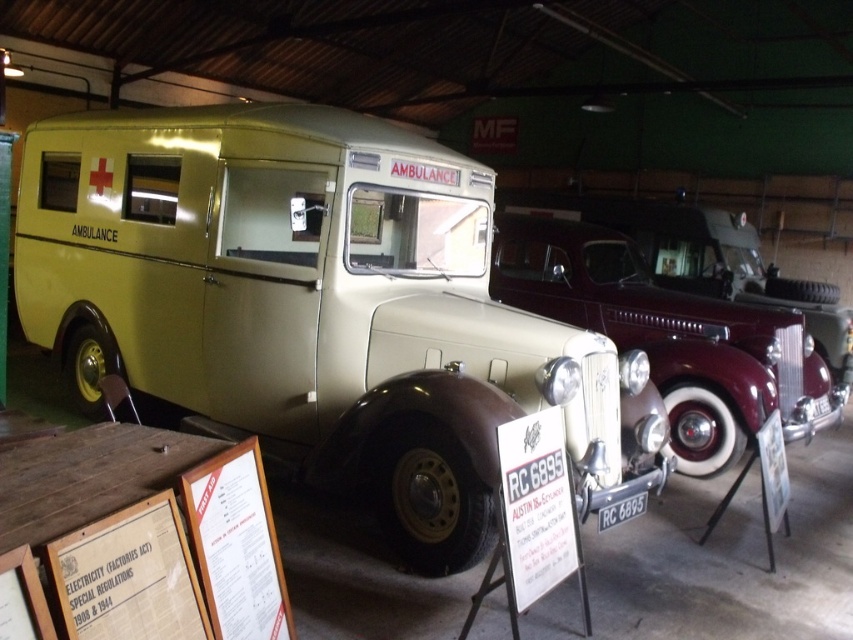
You are a museum guide explaining the vehicles to visitors. You need to mention both the matte beige ambulance at center and the maroon glossy car at center. Which vehicle is bigger?

The matte beige ambulance at center is larger in size compared to the maroon glossy car at center.

You are a tour guide leading a group through the museum. You want to ensure visitors can walk between the matte beige ambulance at center and the maroon glossy car at center without obstruction. What is the minimum width of the pathway required between them?

The minimum width of the pathway required between the matte beige ambulance at center and the maroon glossy car at center should be at least 9.41 feet to allow visitors to walk between them without obstruction.

You are a museum curator planning to move the matte beige ambulance at center and the maroon glossy car at center to a new exhibition hall. The entrance to the hall is 2 meters wide. Can both vehicles fit through the entrance side by side without overlapping?

The matte beige ambulance at center is wider than the maroon glossy car at center. Since the entrance is 2 meters wide, we need to know the combined width of both vehicles to determine if they can fit side by side. However, the exact widths are not provided in the scene description. Therefore, it is impossible to confirm if they can fit without additional measurements.